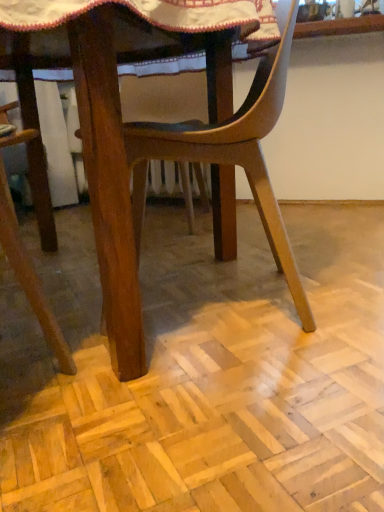
The width and height of the screenshot is (384, 512). Find the location of `unoccupied space behind wooden chair at center`. unoccupied space behind wooden chair at center is located at coordinates (238, 254).